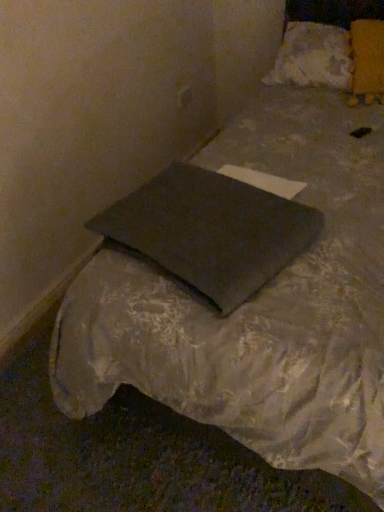
Locate an element on the screen. The image size is (384, 512). dark gray fabric pillow at center, positioned as the third pillow in top-to-bottom order is located at coordinates (210, 232).

The width and height of the screenshot is (384, 512). In order to click on dark gray fabric pillow at center, which is the first pillow from bottom to top in this screenshot , I will do `click(210, 232)`.

Does point (273, 66) lie behind point (368, 90)?

That is True.

Which is more to the right, white fluffy pillow at upper right, which appears as the 3th pillow when viewed from the front, or yellow fabric pillow at upper right, which is counted as the 2th pillow, starting from the top?

Positioned to the right is yellow fabric pillow at upper right, which is counted as the 2th pillow, starting from the top.

How far apart are white fluffy pillow at upper right, which appears as the 3th pillow when viewed from the front, and yellow fabric pillow at upper right, which is the 2th pillow from bottom to top?

A distance of 6.52 inches exists between white fluffy pillow at upper right, which appears as the 3th pillow when viewed from the front, and yellow fabric pillow at upper right, which is the 2th pillow from bottom to top.

Which object is closer to the camera, white fluffy pillow at upper right, the 1th pillow from the top, or yellow fabric pillow at upper right, arranged as the 2th pillow when viewed from the front?

yellow fabric pillow at upper right, arranged as the 2th pillow when viewed from the front, is more forward.

From the image's perspective, would you say dark gray fabric pillow at center, marked as the 1th pillow in a front-to-back arrangement, is shown under yellow fabric pillow at upper right, arranged as the 2th pillow when viewed from the front?

Correct, dark gray fabric pillow at center, marked as the 1th pillow in a front-to-back arrangement, appears lower than yellow fabric pillow at upper right, arranged as the 2th pillow when viewed from the front, in the image.

Is dark gray fabric pillow at center, positioned as the third pillow in top-to-bottom order, oriented towards yellow fabric pillow at upper right, arranged as the 2th pillow when viewed from the front?

No, dark gray fabric pillow at center, positioned as the third pillow in top-to-bottom order, is not facing towards yellow fabric pillow at upper right, arranged as the 2th pillow when viewed from the front.

Is dark gray fabric pillow at center, marked as the 1th pillow in a front-to-back arrangement, far from yellow fabric pillow at upper right, which is the 2th pillow from bottom to top?

dark gray fabric pillow at center, marked as the 1th pillow in a front-to-back arrangement, is positioned a significant distance from yellow fabric pillow at upper right, which is the 2th pillow from bottom to top.

Consider the image. Is white fluffy pillow at upper right, which is the third pillow in bottom-to-top order, to the left or to the right of dark gray fabric pillow at center, positioned as the third pillow in top-to-bottom order, in the image?

Clearly, white fluffy pillow at upper right, which is the third pillow in bottom-to-top order, is on the right of dark gray fabric pillow at center, positioned as the third pillow in top-to-bottom order, in the image.

Could you tell me if white fluffy pillow at upper right, the 1th pillow from the top, is facing dark gray fabric pillow at center, positioned as the third pillow in top-to-bottom order?

Yes, white fluffy pillow at upper right, the 1th pillow from the top, is turned towards dark gray fabric pillow at center, positioned as the third pillow in top-to-bottom order.

Based on the photo, in terms of height, does white fluffy pillow at upper right, which is the third pillow in bottom-to-top order, look taller or shorter compared to dark gray fabric pillow at center, which is the first pillow from bottom to top?

Clearly, white fluffy pillow at upper right, which is the third pillow in bottom-to-top order, is taller compared to dark gray fabric pillow at center, which is the first pillow from bottom to top.

Can you tell me how much white fluffy pillow at upper right, which appears as the 3th pillow when viewed from the front, and dark gray fabric pillow at center, which is the first pillow from bottom to top, differ in facing direction?

17.3 degrees separate the facing orientations of white fluffy pillow at upper right, which appears as the 3th pillow when viewed from the front, and dark gray fabric pillow at center, which is the first pillow from bottom to top.

Can you tell me how much dark gray fabric pillow at center, marked as the 1th pillow in a front-to-back arrangement, and white fluffy pillow at upper right, marked as the first pillow in a back-to-front arrangement, differ in facing direction?

There is a 17.3-degree angle between the facing directions of dark gray fabric pillow at center, marked as the 1th pillow in a front-to-back arrangement, and white fluffy pillow at upper right, marked as the first pillow in a back-to-front arrangement.

From the image's perspective, between dark gray fabric pillow at center, marked as the 1th pillow in a front-to-back arrangement, and white fluffy pillow at upper right, the 1th pillow from the top, who is located below?

dark gray fabric pillow at center, marked as the 1th pillow in a front-to-back arrangement, from the image's perspective.

Which object is wider, dark gray fabric pillow at center, positioned as the third pillow in top-to-bottom order, or white fluffy pillow at upper right, the 1th pillow from the top?

Wider between the two is dark gray fabric pillow at center, positioned as the third pillow in top-to-bottom order.

Is dark gray fabric pillow at center, positioned as the third pillow in top-to-bottom order, not inside white fluffy pillow at upper right, marked as the first pillow in a back-to-front arrangement?

Absolutely, dark gray fabric pillow at center, positioned as the third pillow in top-to-bottom order, is external to white fluffy pillow at upper right, marked as the first pillow in a back-to-front arrangement.

From the image's perspective, would you say yellow fabric pillow at upper right, acting as the second pillow starting from the back, is shown under dark gray fabric pillow at center, which is the first pillow from bottom to top?

No, from the image's perspective, yellow fabric pillow at upper right, acting as the second pillow starting from the back, is not beneath dark gray fabric pillow at center, which is the first pillow from bottom to top.

Do you think yellow fabric pillow at upper right, acting as the second pillow starting from the back, is within dark gray fabric pillow at center, marked as the 3th pillow in a back-to-front arrangement, or outside of it?

yellow fabric pillow at upper right, acting as the second pillow starting from the back, is not inside dark gray fabric pillow at center, marked as the 3th pillow in a back-to-front arrangement, it's outside.

Considering the relative sizes of yellow fabric pillow at upper right, which is counted as the 2th pillow, starting from the top, and dark gray fabric pillow at center, which is the first pillow from bottom to top, in the image provided, is yellow fabric pillow at upper right, which is counted as the 2th pillow, starting from the top, taller than dark gray fabric pillow at center, which is the first pillow from bottom to top,?

Correct, yellow fabric pillow at upper right, which is counted as the 2th pillow, starting from the top, is much taller as dark gray fabric pillow at center, which is the first pillow from bottom to top.

From a real-world perspective, which is physically below, yellow fabric pillow at upper right, arranged as the 2th pillow when viewed from the front, or dark gray fabric pillow at center, marked as the 3th pillow in a back-to-front arrangement?

From a 3D spatial view, dark gray fabric pillow at center, marked as the 3th pillow in a back-to-front arrangement, is below.

Which of these two, yellow fabric pillow at upper right, acting as the second pillow starting from the back, or white fluffy pillow at upper right, which is the third pillow in bottom-to-top order, is smaller?

With smaller size is yellow fabric pillow at upper right, acting as the second pillow starting from the back.

Which is in front, yellow fabric pillow at upper right, which is the 2th pillow from bottom to top, or white fluffy pillow at upper right, which appears as the 3th pillow when viewed from the front?

yellow fabric pillow at upper right, which is the 2th pillow from bottom to top, is closer to the camera.

From a real-world perspective, who is located lower, yellow fabric pillow at upper right, which is the 2th pillow from bottom to top, or white fluffy pillow at upper right, which appears as the 3th pillow when viewed from the front?

white fluffy pillow at upper right, which appears as the 3th pillow when viewed from the front, from a real-world perspective.

Identify the location of pillow on the right side of white fluffy pillow at upper right, marked as the first pillow in a back-to-front arrangement. (368, 56).

This screenshot has height=512, width=384. In order to click on the 2nd pillow to the left of the yellow fabric pillow at upper right, which is the 2th pillow from bottom to top, starting your count from the anchor in this screenshot , I will do `click(210, 232)`.

When comparing their distances from yellow fabric pillow at upper right, arranged as the 2th pillow when viewed from the front, does dark gray fabric pillow at center, marked as the 3th pillow in a back-to-front arrangement, or white fluffy pillow at upper right, which appears as the 3th pillow when viewed from the front, seem closer?

white fluffy pillow at upper right, which appears as the 3th pillow when viewed from the front, lies closer to yellow fabric pillow at upper right, arranged as the 2th pillow when viewed from the front, than the other object.

From the image, which object appears to be farther from yellow fabric pillow at upper right, arranged as the 2th pillow when viewed from the front, white fluffy pillow at upper right, marked as the first pillow in a back-to-front arrangement, or dark gray fabric pillow at center, which is the first pillow from bottom to top?

Based on the image, dark gray fabric pillow at center, which is the first pillow from bottom to top, appears to be further to yellow fabric pillow at upper right, arranged as the 2th pillow when viewed from the front.

Based on their spatial positions, is yellow fabric pillow at upper right, which is counted as the 2th pillow, starting from the top, or white fluffy pillow at upper right, which is the third pillow in bottom-to-top order, closer to dark gray fabric pillow at center, marked as the 3th pillow in a back-to-front arrangement?

yellow fabric pillow at upper right, which is counted as the 2th pillow, starting from the top, is positioned closer to the anchor dark gray fabric pillow at center, marked as the 3th pillow in a back-to-front arrangement.

Looking at the image, which one is located further to dark gray fabric pillow at center, marked as the 3th pillow in a back-to-front arrangement, white fluffy pillow at upper right, marked as the first pillow in a back-to-front arrangement, or yellow fabric pillow at upper right, arranged as the 2th pillow when viewed from the front?

The object further to dark gray fabric pillow at center, marked as the 3th pillow in a back-to-front arrangement, is white fluffy pillow at upper right, marked as the first pillow in a back-to-front arrangement.

Considering their positions, is dark gray fabric pillow at center, marked as the 1th pillow in a front-to-back arrangement, positioned further to white fluffy pillow at upper right, marked as the first pillow in a back-to-front arrangement, than yellow fabric pillow at upper right, which is the 2th pillow from bottom to top?

Based on the image, dark gray fabric pillow at center, marked as the 1th pillow in a front-to-back arrangement, appears to be further to white fluffy pillow at upper right, marked as the first pillow in a back-to-front arrangement.

Looking at the image, which one is located closer to white fluffy pillow at upper right, the 1th pillow from the top, yellow fabric pillow at upper right, acting as the second pillow starting from the back, or dark gray fabric pillow at center, positioned as the third pillow in top-to-bottom order?

yellow fabric pillow at upper right, acting as the second pillow starting from the back, is closer to white fluffy pillow at upper right, the 1th pillow from the top.

This screenshot has height=512, width=384. Find the location of `pillow between dark gray fabric pillow at center, marked as the 1th pillow in a front-to-back arrangement, and white fluffy pillow at upper right, the 1th pillow from the top, along the z-axis`. pillow between dark gray fabric pillow at center, marked as the 1th pillow in a front-to-back arrangement, and white fluffy pillow at upper right, the 1th pillow from the top, along the z-axis is located at coordinates (x=368, y=56).